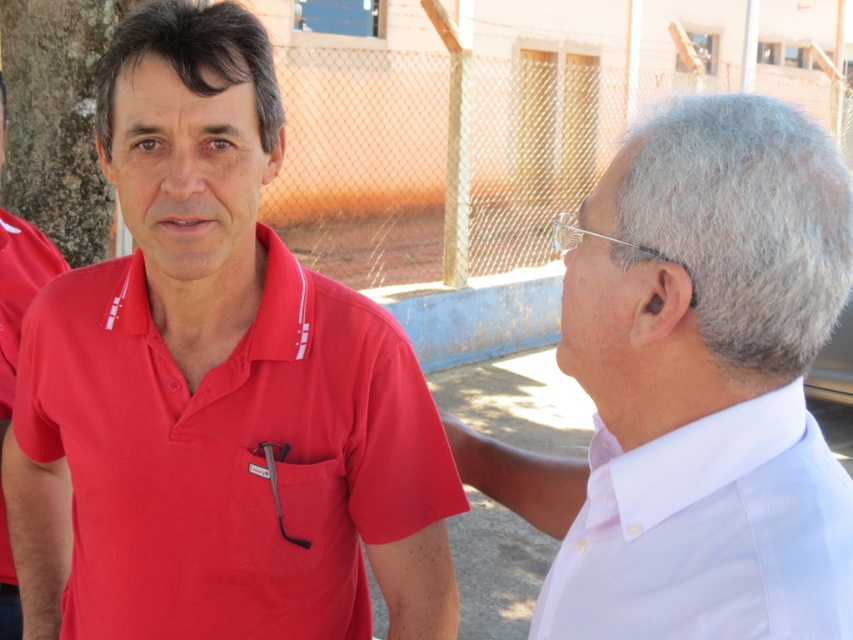
From the picture: You are standing at the camera position and want to reach the point at coordinates (146, 186). If your stride length is 2.1 feet per step, how many steps do you need to take to reach that point?

The distance of point (146, 186) from camera is 4.22 feet. Dividing the total distance by the stride length gives 4.22 divided by 2.1 equals approximately 2.01 steps. Since you can only take whole steps, you would need to take 2 steps to reach the point at coordinates (146, 186).

You are a painter standing between the matte red polo shirt at left and the green rough bark at left. You want to paint the object that is closer to you. Which one should you paint?

The matte red polo shirt at left is closer to the viewer than the green rough bark at left, so you should paint the matte red polo shirt at left.

You are a delivery person who needs to place a package between the white textured shirt at right and the green rough bark at left. The package requires a minimum of 3 meters of space to be placed safely. Can you safely place the package there?

The white textured shirt at right and green rough bark at left are 3.16 meters apart, so yes, the package can be safely placed between them as the distance meets the required minimum of 3 meters.